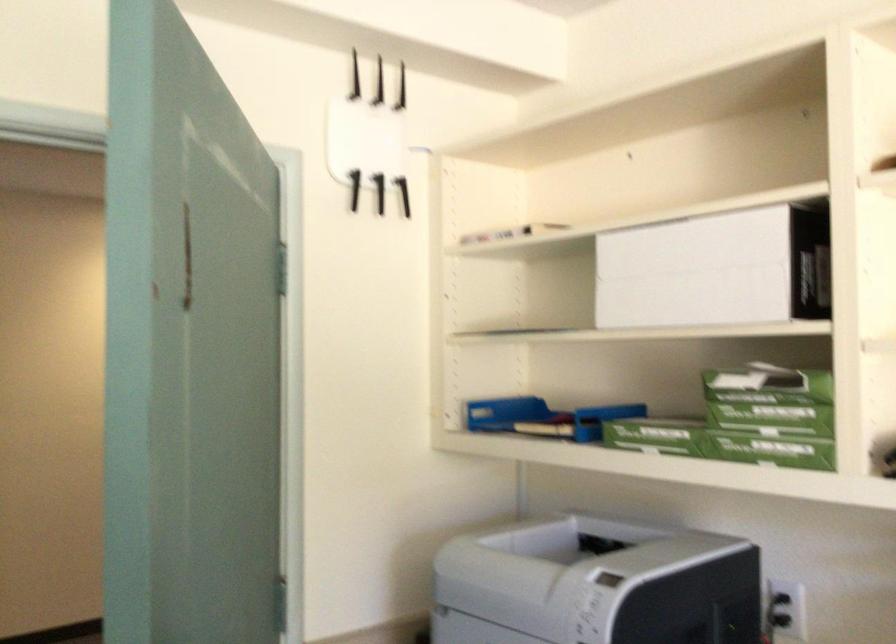
Identify the location of white paper box. The height and width of the screenshot is (644, 896). (716, 269).